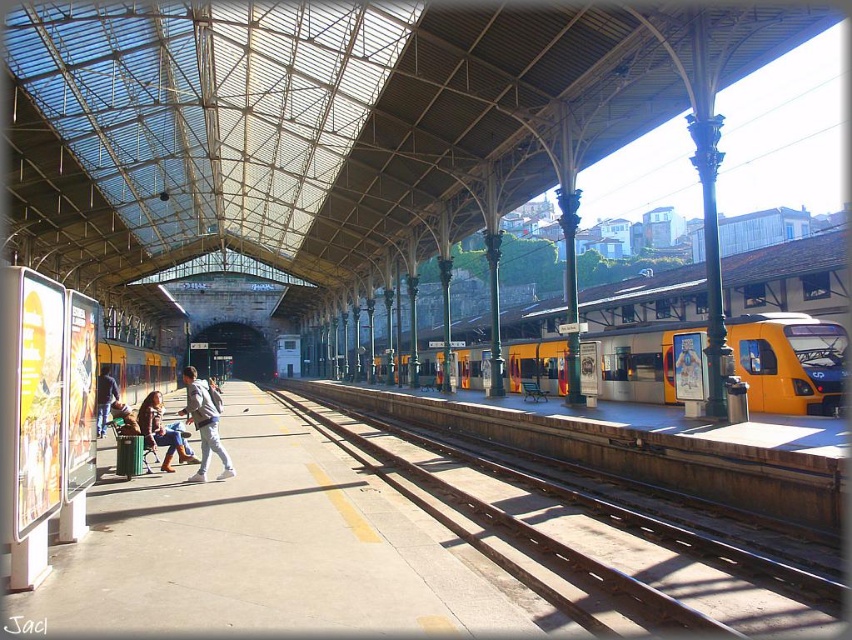
Question: Is the position of yellow metallic train at center less distant than that of light brown leather jacket at center?

Choices:
 (A) yes
 (B) no

Answer: (A)

Question: Does yellow metallic train at center appear on the right side of light brown leather jacket at center?

Choices:
 (A) yes
 (B) no

Answer: (B)

Question: Does metal/smooth track at center have a lesser width compared to yellow metallic train at center?

Choices:
 (A) yes
 (B) no

Answer: (A)

Question: Among these points, which one is nearest to the camera?

Choices:
 (A) (147, 432)
 (B) (695, 394)

Answer: (A)

Question: Which object is positioned closest to the light gray fabric jacket at center?

Choices:
 (A) metal/smooth track at center
 (B) denim jacket at lower left
 (C) light brown leather jacket at center
 (D) denim jacket at center

Answer: (D)

Question: Which point is farther to the camera?

Choices:
 (A) light brown leather jacket at center
 (B) metal/smooth track at center
 (C) denim jacket at lower left

Answer: (A)